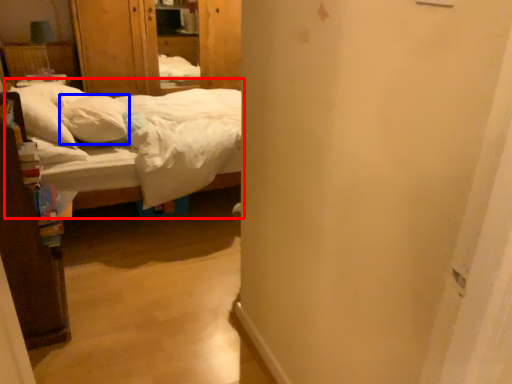
Question: Which object is further to the camera taking this photo, bed (highlighted by a red box) or pillow (highlighted by a blue box)?

Choices:
 (A) bed
 (B) pillow

Answer: (B)